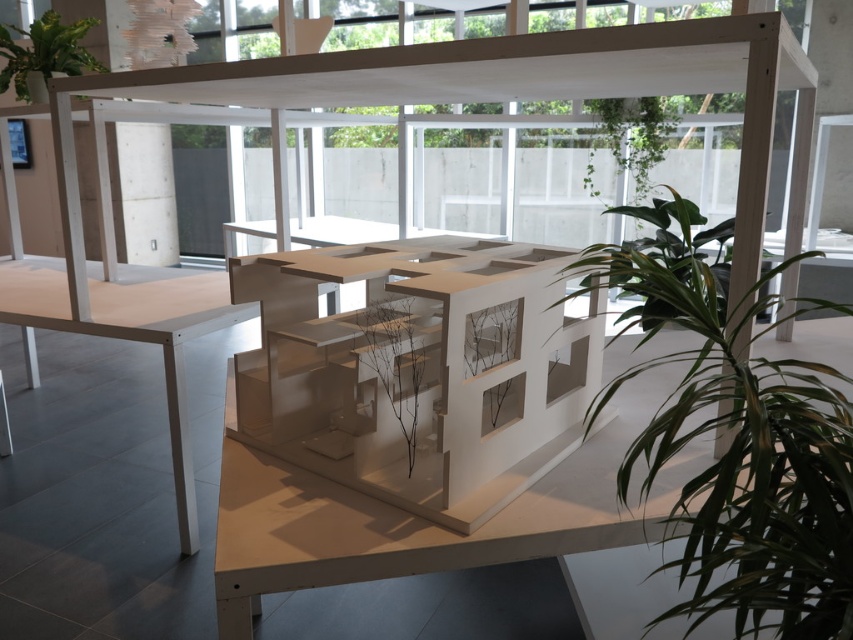
You are an interior designer assessing the placement of plants in the room. Which of the two plants, the green leafy plant at center or the green matte plant at upper left, would cast a larger shadow given their sizes?

The green leafy plant at center is bigger than the green matte plant at upper left, so it would cast a larger shadow.

You are an interior designer evaluating the placement of plants in the architectural model setup. Which plant, the green leafy plant at center or the green matte plant at upper left, is located to the right of the other?

The green leafy plant at center is positioned on the right side of the green matte plant at upper left.

You are an interior designer assessing the placement of plants in the architectural model display. The brown matte plant at center and the green leafy plant at upper right are both part of the design. Which plant is shorter?

The brown matte plant at center is shorter than the green leafy plant at upper right.